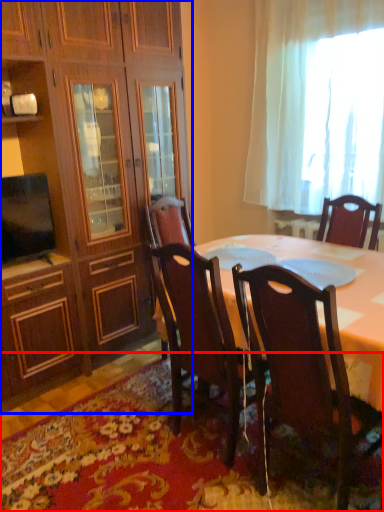
Question: Which point is closer to the camera, mat (highlighted by a red box) or cabinetry (highlighted by a blue box)?

Choices:
 (A) mat
 (B) cabinetry

Answer: (A)